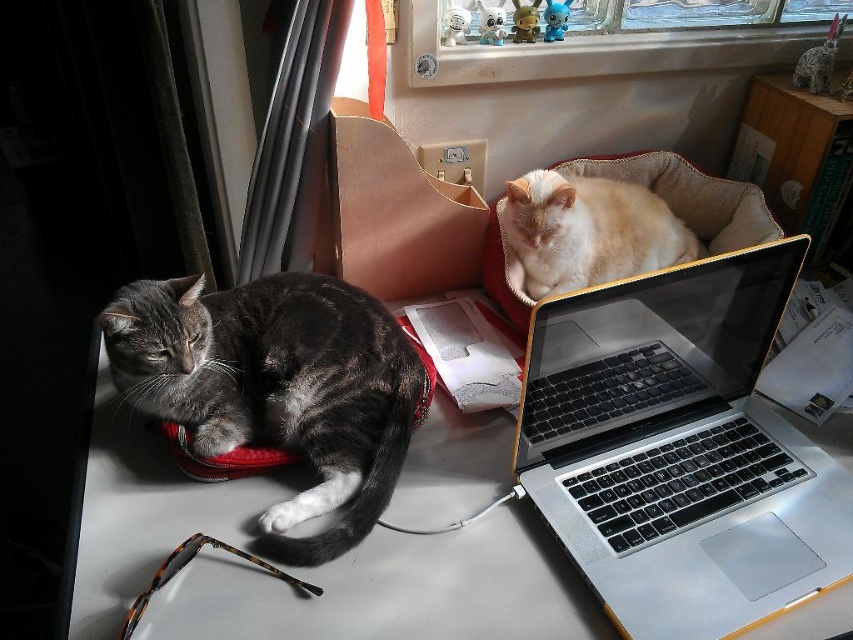
Does white glossy table at lower left appear on the right side of orange fur cat at upper right?

Incorrect, white glossy table at lower left is not on the right side of orange fur cat at upper right.

Does point (259, 621) lie in front of point (579, 202)?

Yes, point (259, 621) is in front of point (579, 202).

This screenshot has height=640, width=853. Identify the location of white glossy table at lower left. (397, 592).

Locate an element on the screen. Image resolution: width=853 pixels, height=640 pixels. white glossy table at lower left is located at coordinates (397, 592).

Who is positioned more to the left, silver metallic laptop at center or white glossy table at lower left?

From the viewer's perspective, white glossy table at lower left appears more on the left side.

The width and height of the screenshot is (853, 640). What do you see at coordinates (679, 449) in the screenshot?
I see `silver metallic laptop at center` at bounding box center [679, 449].

At what (x,y) coordinates should I click in order to perform the action: click on silver metallic laptop at center. Please return your answer as a coordinate pair (x, y). This screenshot has width=853, height=640. Looking at the image, I should click on point(679,449).

Between silver metallic laptop at center and gray fur cat at left, which one appears on the left side from the viewer's perspective?

gray fur cat at left is more to the left.

How much distance is there between silver metallic laptop at center and gray fur cat at left?

The distance of silver metallic laptop at center from gray fur cat at left is 15.25 inches.

What do you see at coordinates (679, 449) in the screenshot? This screenshot has height=640, width=853. I see `silver metallic laptop at center` at bounding box center [679, 449].

The width and height of the screenshot is (853, 640). In order to click on silver metallic laptop at center in this screenshot , I will do `click(679, 449)`.